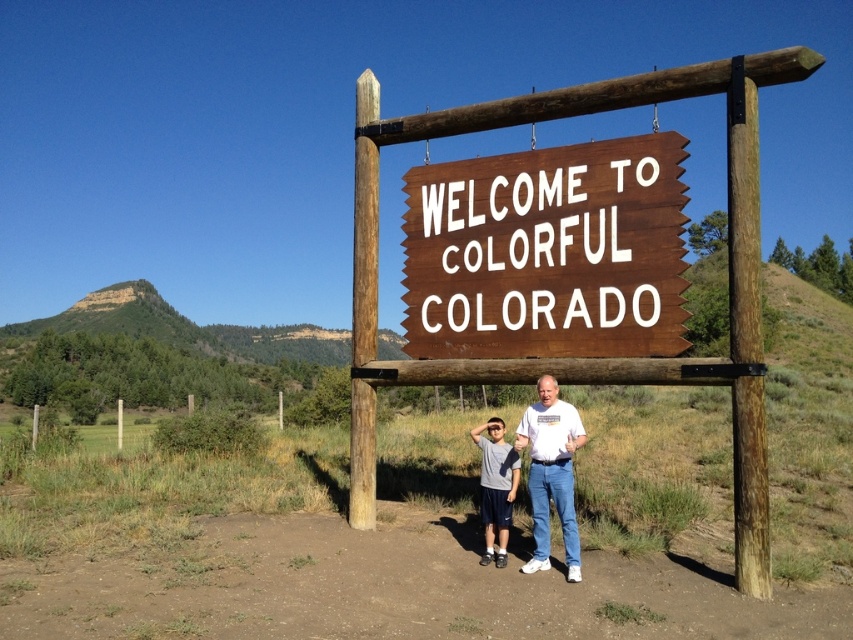
You are a photographer taking a picture of the scene. You notice the white t shirt at center is represented by point (550, 472). Where should you position your focus point to ensure the white t shirt at center is in sharp focus?

You should position your focus point at the coordinates (550, 472) to ensure the white t shirt at center is in sharp focus.

You are taking a photo of the wooden signboard with the two people in front of it. You want to ensure both the signboard and the people are in focus. Which point, point (682,317) or point (503,449), should you focus on to capture both the signboard and the people clearly?

You should focus on point (682,317) because it is closer to the viewer than point (503,449). This will ensure the people in front are in focus while the signboard in the background remains sharp.